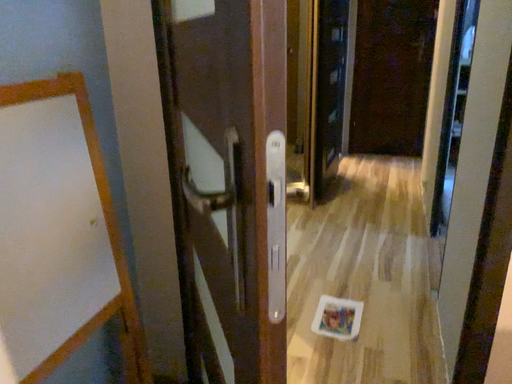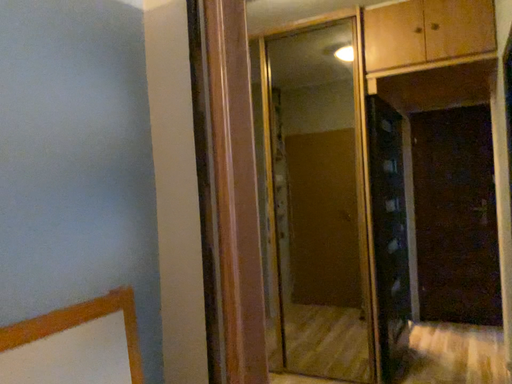
Question: Which way did the camera rotate in the video?

Choices:
 (A) rotated left
 (B) rotated right

Answer: (A)